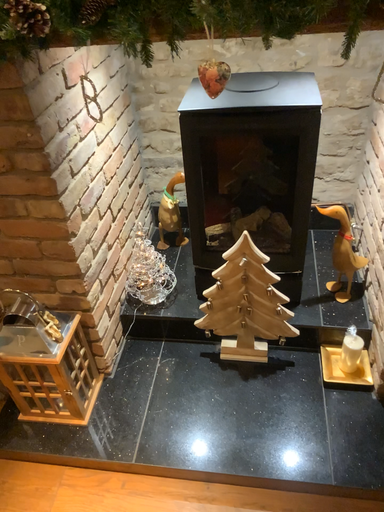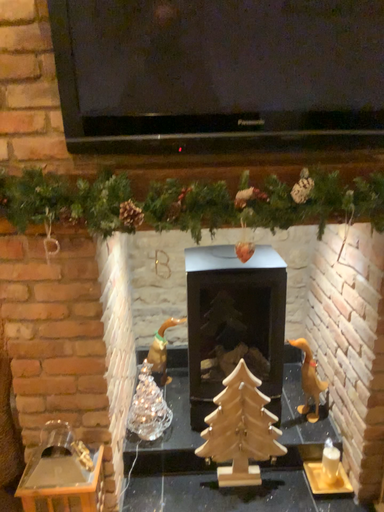
Question: Which way did the camera rotate in the video?

Choices:
 (A) rotated right
 (B) rotated left

Answer: (A)